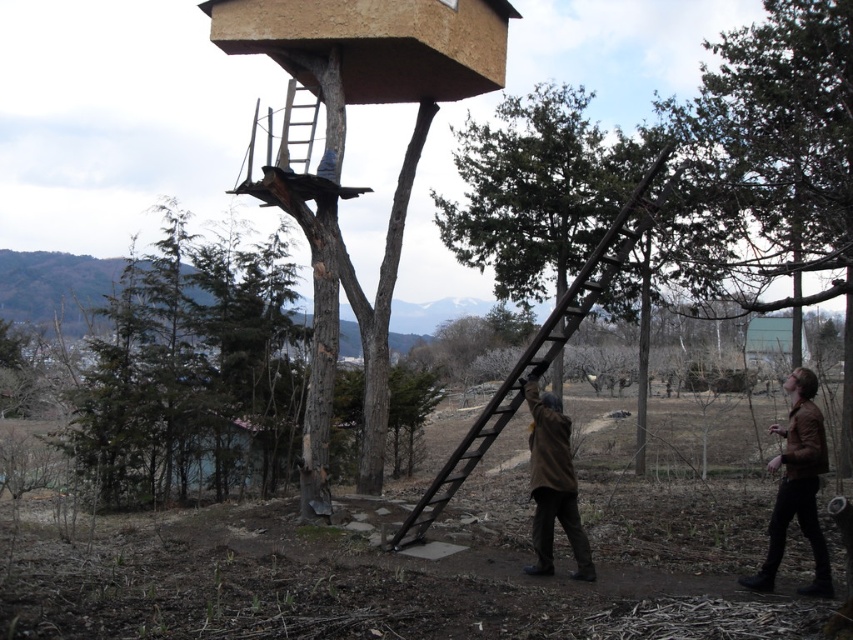
You are an explorer who found a brown woolen coat at lower center and a wooden at center in the outdoor scene. Which object is larger?

The wooden at center is larger than the brown woolen coat at lower center.

You are standing in front of the structure built around the tree and want to place a new sign. You have two points marked on the structure where you can attach the sign. The points are labeled as point [627,227] and point [572,520]. Which point is closer to you when you are facing the structure?

Point [627,227] is further to the viewer than point [572,520], so the point closer to you is point [572,520].